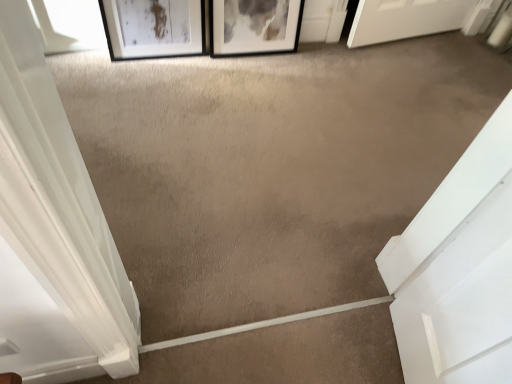
Locate an element on the screen. The height and width of the screenshot is (384, 512). black matte picture frame at upper center, the first picture frame viewed from the right is located at coordinates (254, 27).

You are a GUI agent. You are given a task and a screenshot of the screen. Output one action in this format:
    pyautogui.click(x=<x>, y=<y>)
    Task: Click on the transparent glass window at upper left
    Image resolution: width=512 pixels, height=384 pixels.
    Given the screenshot: What is the action you would take?
    pyautogui.click(x=68, y=25)

Can you see black matte picture frame at upper center, the first picture frame viewed from the right, touching transparent glass window at upper left?

No, black matte picture frame at upper center, the first picture frame viewed from the right, is not beside transparent glass window at upper left.

Does black matte picture frame at upper center, the 2th picture frame from the left, have a greater height compared to transparent glass window at upper left?

Yes.

Is point (213, 28) positioned in front of point (68, 11)?

No, it is behind (68, 11).

Can you tell me how much black matte picture frame at upper center, the first picture frame viewed from the right, and transparent glass window at upper left differ in facing direction?

The angular difference between black matte picture frame at upper center, the first picture frame viewed from the right, and transparent glass window at upper left is 2.25 degrees.

Is black matte picture frame at upper center, the first picture frame viewed from the right, in contact with matte black picture frame at upper left, which is the first picture frame in left-to-right order?

No, black matte picture frame at upper center, the first picture frame viewed from the right, is not beside matte black picture frame at upper left, which is the first picture frame in left-to-right order.

From the image's perspective, which is above, black matte picture frame at upper center, the 2th picture frame from the left, or matte black picture frame at upper left, which is the first picture frame in left-to-right order?

From the image's view, black matte picture frame at upper center, the 2th picture frame from the left, is above.

Which is farther from the camera, (223, 11) or (180, 4)?

The point (223, 11) is more distant.

Do you think black matte picture frame at upper center, the first picture frame viewed from the right, is within matte black picture frame at upper left, which is the first picture frame in left-to-right order, or outside of it?

black matte picture frame at upper center, the first picture frame viewed from the right, is spatially situated outside matte black picture frame at upper left, which is the first picture frame in left-to-right order.

How much distance is there between matte black picture frame at upper left, acting as the second picture frame starting from the right, and black matte picture frame at upper center, the 2th picture frame from the left?

The distance of matte black picture frame at upper left, acting as the second picture frame starting from the right, from black matte picture frame at upper center, the 2th picture frame from the left, is 9.04 inches.

Can you confirm if matte black picture frame at upper left, acting as the second picture frame starting from the right, is positioned to the left of black matte picture frame at upper center, the 2th picture frame from the left?

Correct, you'll find matte black picture frame at upper left, acting as the second picture frame starting from the right, to the left of black matte picture frame at upper center, the 2th picture frame from the left.

Based on the photo, considering the sizes of objects matte black picture frame at upper left, acting as the second picture frame starting from the right, and black matte picture frame at upper center, the 2th picture frame from the left, in the image provided, who is bigger, matte black picture frame at upper left, acting as the second picture frame starting from the right, or black matte picture frame at upper center, the 2th picture frame from the left,?

Bigger between the two is black matte picture frame at upper center, the 2th picture frame from the left.

In the scene shown: Are matte black picture frame at upper left, acting as the second picture frame starting from the right, and black matte picture frame at upper center, the first picture frame viewed from the right, making contact?

No.

Is matte black picture frame at upper left, acting as the second picture frame starting from the right, beside transparent glass window at upper left?

matte black picture frame at upper left, acting as the second picture frame starting from the right, and transparent glass window at upper left are clearly separated.

In order to click on picture frame that is the 1st one when counting rightward from the transparent glass window at upper left in this screenshot , I will do `click(153, 28)`.

Considering the positions of objects matte black picture frame at upper left, which is the first picture frame in left-to-right order, and transparent glass window at upper left in the image provided, who is more to the right, matte black picture frame at upper left, which is the first picture frame in left-to-right order, or transparent glass window at upper left?

Positioned to the right is matte black picture frame at upper left, which is the first picture frame in left-to-right order.

Is matte black picture frame at upper left, acting as the second picture frame starting from the right, oriented away from transparent glass window at upper left?

No, transparent glass window at upper left is not at the back of matte black picture frame at upper left, acting as the second picture frame starting from the right.

From the image's perspective, is transparent glass window at upper left located beneath matte black picture frame at upper left, acting as the second picture frame starting from the right?

No, from the image's perspective, transparent glass window at upper left is not beneath matte black picture frame at upper left, acting as the second picture frame starting from the right.

Considering their positions, is transparent glass window at upper left located in front of or behind matte black picture frame at upper left, which is the first picture frame in left-to-right order?

Visually, transparent glass window at upper left is located behind matte black picture frame at upper left, which is the first picture frame in left-to-right order.

Is transparent glass window at upper left oriented towards matte black picture frame at upper left, which is the first picture frame in left-to-right order?

No, transparent glass window at upper left is not turned towards matte black picture frame at upper left, which is the first picture frame in left-to-right order.

Based on the photo, which object is positioned more to the left, transparent glass window at upper left or matte black picture frame at upper left, which is the first picture frame in left-to-right order?

transparent glass window at upper left.

Between transparent glass window at upper left and black matte picture frame at upper center, the first picture frame viewed from the right, which one has smaller size?

Smaller between the two is transparent glass window at upper left.

Is the depth of transparent glass window at upper left less than that of black matte picture frame at upper center, the 2th picture frame from the left?

Yes.

This screenshot has height=384, width=512. I want to click on picture frame behind the transparent glass window at upper left, so click(x=254, y=27).

The width and height of the screenshot is (512, 384). Identify the location of picture frame on the left of the black matte picture frame at upper center, the first picture frame viewed from the right. (153, 28).

From the image, which object appears to be nearer to black matte picture frame at upper center, the 2th picture frame from the left, matte black picture frame at upper left, acting as the second picture frame starting from the right, or transparent glass window at upper left?

Based on the image, matte black picture frame at upper left, acting as the second picture frame starting from the right, appears to be nearer to black matte picture frame at upper center, the 2th picture frame from the left.

Based on their spatial positions, is transparent glass window at upper left or matte black picture frame at upper left, acting as the second picture frame starting from the right, closer to black matte picture frame at upper center, the first picture frame viewed from the right?

matte black picture frame at upper left, acting as the second picture frame starting from the right, lies closer to black matte picture frame at upper center, the first picture frame viewed from the right, than the other object.

When comparing their distances from matte black picture frame at upper left, which is the first picture frame in left-to-right order, does black matte picture frame at upper center, the first picture frame viewed from the right, or transparent glass window at upper left seem closer?

Based on the image, transparent glass window at upper left appears to be nearer to matte black picture frame at upper left, which is the first picture frame in left-to-right order.

Looking at this image, which object lies nearer to the anchor point matte black picture frame at upper left, acting as the second picture frame starting from the right, transparent glass window at upper left or black matte picture frame at upper center, the 2th picture frame from the left?

Based on the image, transparent glass window at upper left appears to be nearer to matte black picture frame at upper left, acting as the second picture frame starting from the right.

Looking at the image, which one is located closer to transparent glass window at upper left, black matte picture frame at upper center, the first picture frame viewed from the right, or matte black picture frame at upper left, acting as the second picture frame starting from the right?

matte black picture frame at upper left, acting as the second picture frame starting from the right, lies closer to transparent glass window at upper left than the other object.

Based on their spatial positions, is matte black picture frame at upper left, which is the first picture frame in left-to-right order, or black matte picture frame at upper center, the 2th picture frame from the left, closer to transparent glass window at upper left?

matte black picture frame at upper left, which is the first picture frame in left-to-right order, is closer to transparent glass window at upper left.

The image size is (512, 384). What are the coordinates of `picture frame between transparent glass window at upper left and black matte picture frame at upper center, the 2th picture frame from the left` in the screenshot? It's located at (153, 28).